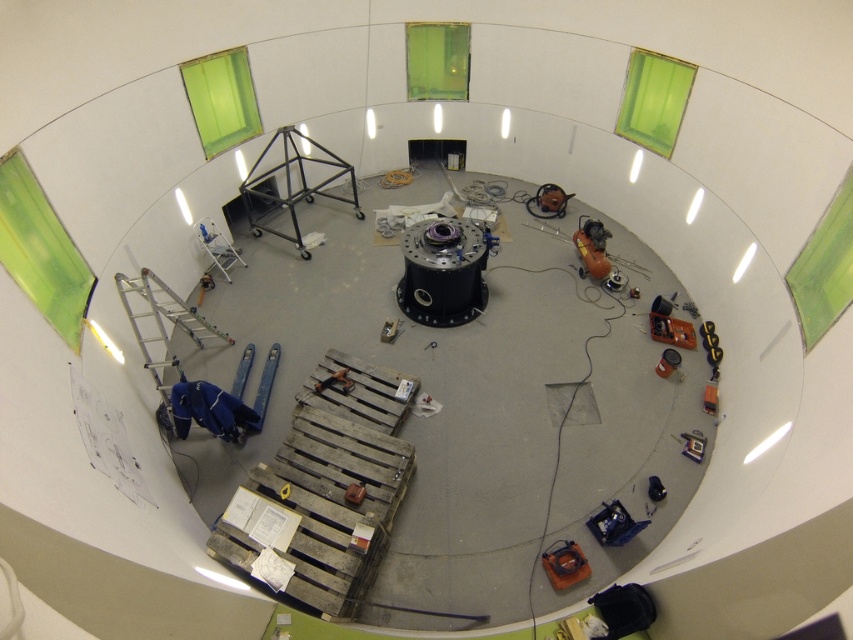
You are an engineer in this workspace and need to locate the matte black helmet at center. From your current position at the weathered wood pallet at lower left, in which direction should you move to reach it?

The weathered wood pallet at lower left is to the left of the matte black helmet at center, so you should move to the right to reach the matte black helmet at center.

You are an engineer inspecting the workspace from above. You need to reach the orange rubber hose at lower right first before moving to the black matte motor at center. Which object should you approach first based on their positions?

You should approach the orange rubber hose at lower right first because it is closer to you than the black matte motor at center, which is further away.

You are an engineer needing to connect the black matte motor at center to the orange rubber hose at lower right with a 2.5 meter long tube. Based on the workspace layout shown, will the tube be long enough to reach between the two?

The black matte motor at center and orange rubber hose at lower right are 2.40 meters apart. The tube is 2.5 meters long, which is slightly longer than the distance between them. Therefore, the tube will be long enough to reach between the two.